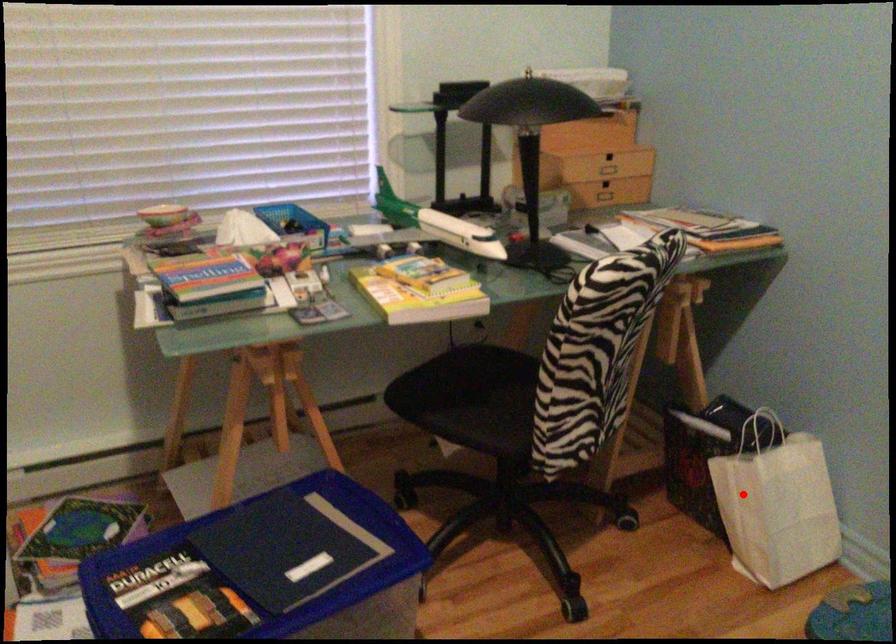
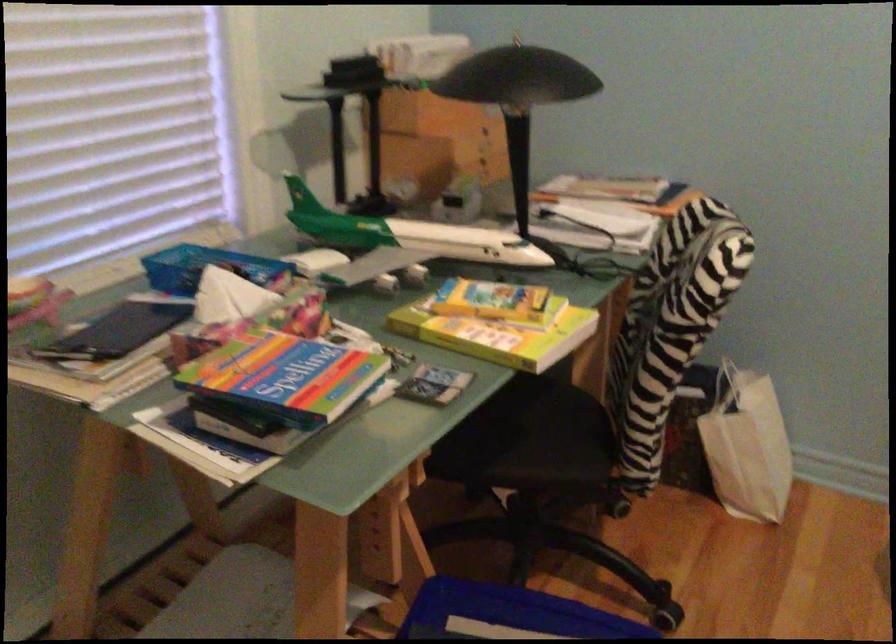
Locate, in the second image, the point that corresponds to the highlighted location in the first image.

(746, 446)